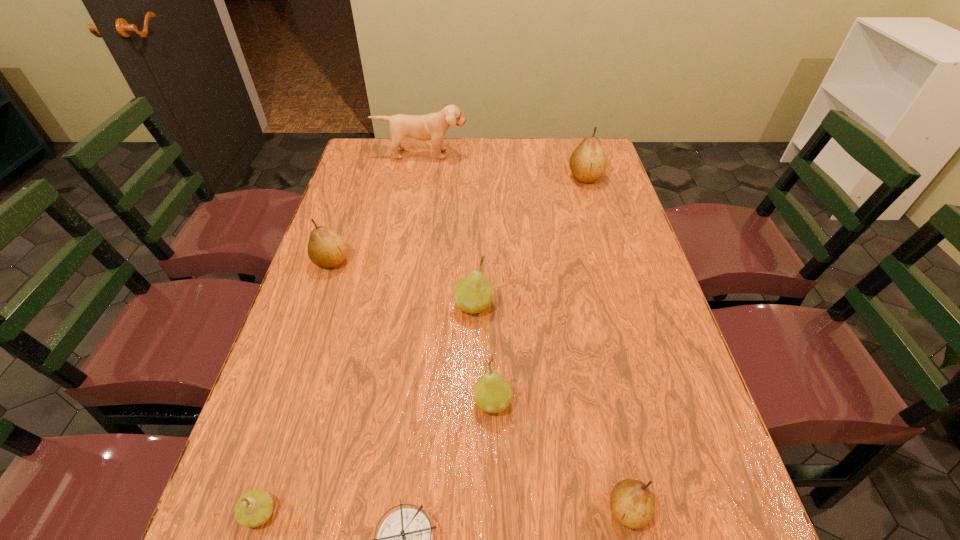
You are a GUI agent. You are given a task and a screenshot of the screen. Output one action in this format:
    pyautogui.click(x=<x>, y=<y>)
    Task: Click on the farthest object
    
    Given the screenshot: What is the action you would take?
    pyautogui.click(x=433, y=126)

At what (x,y) coordinates should I click in order to perform the action: click on beige puppy. Please return your answer as a coordinate pair (x, y). This screenshot has width=960, height=540. Looking at the image, I should click on (433, 126).

The image size is (960, 540). Identify the location of the rightmost brown pear. (588, 162).

Where is `the rightmost object`? The height and width of the screenshot is (540, 960). the rightmost object is located at coordinates (588, 162).

What are the coordinates of `the biggest green pear` in the screenshot? It's located at (473, 294).

Locate an element on the screen. the fourth farthest object is located at coordinates (473, 294).

Locate an element on the screen. the second smallest brown pear is located at coordinates [327, 249].

Identify the location of the sixth nearest object. This screenshot has width=960, height=540. (327, 249).

Find the location of `the second nearest green pear`. the second nearest green pear is located at coordinates (492, 393).

This screenshot has height=540, width=960. I want to click on the fourth farthest pear, so click(492, 393).